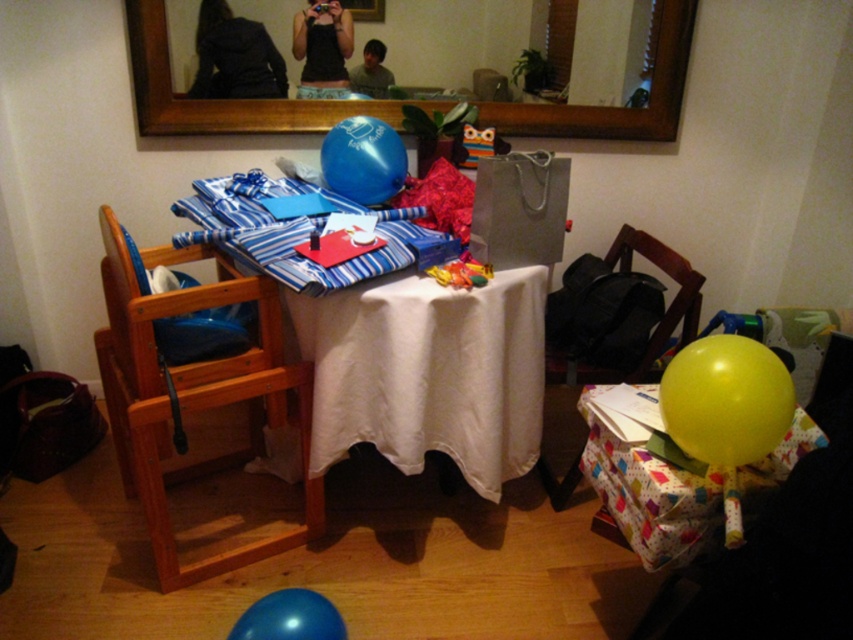
Question: Which object is the closest to the yellow rubber balloon at lower right?

Choices:
 (A) black tank top at center
 (B) black fabric at upper center
 (C) wooden chair at right

Answer: (C)

Question: Which point is closer to the camera taking this photo?

Choices:
 (A) (206, 218)
 (B) (363, 86)
 (C) (674, 304)

Answer: (A)

Question: Which of the following is the farthest from the observer?

Choices:
 (A) (398, 172)
 (B) (132, 356)
 (C) (698, 374)

Answer: (A)

Question: Considering the relative positions of wooden frame mirror at upper center and yellow paper at center in the image provided, where is wooden frame mirror at upper center located with respect to yellow paper at center?

Choices:
 (A) above
 (B) below

Answer: (A)

Question: Is white cloth at center above black tank top at center?

Choices:
 (A) no
 (B) yes

Answer: (A)

Question: In this image, where is blue rubber balloon at upper center located relative to black tank top at center?

Choices:
 (A) below
 (B) above

Answer: (A)